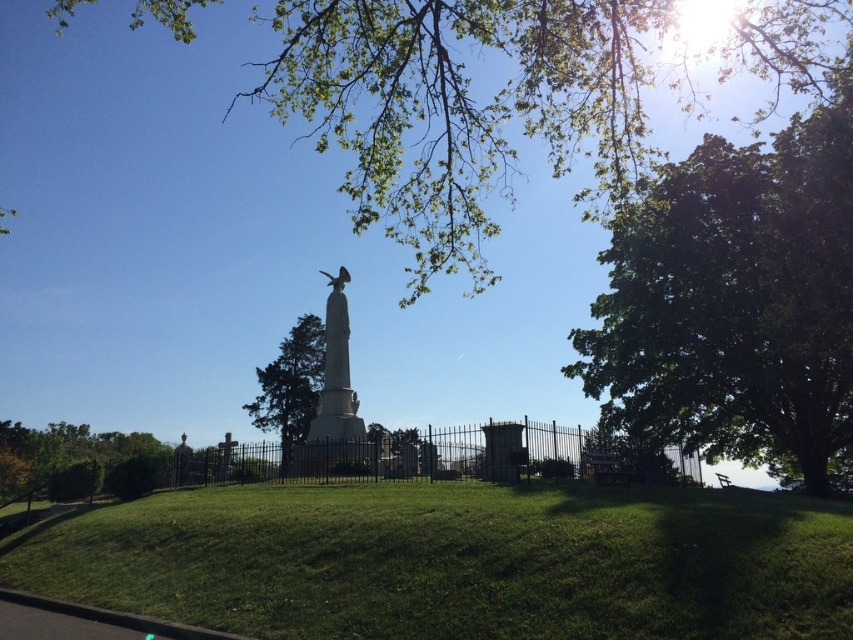
You are a visitor standing at the base of the monument. Looking up, you see the green leafy tree at upper center and the white marble statue at center. Which object is positioned higher in the scene?

The green leafy tree at upper center is positioned higher than the white marble statue at center.

You are a photographer planning to capture a wide shot of the monument. You want to ensure both the green leafy tree at upper center and the black wrought iron fence at center are visible in your frame. Based on their sizes, which object should you position closer to the edge of the frame to avoid overcrowding?

The green leafy tree at upper center has a larger width than the black wrought iron fence at center, so you should position the green leafy tree at upper center closer to the edge of the frame to avoid overcrowding.